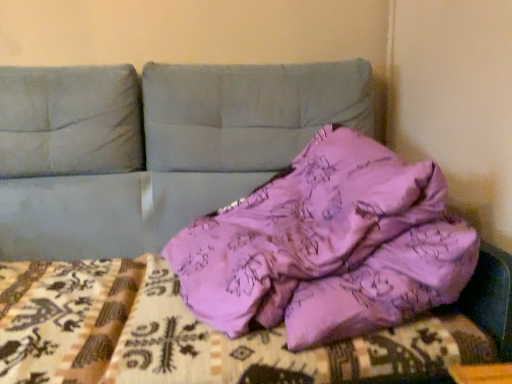
What do you see at coordinates (328, 247) in the screenshot? I see `pink fabric pillow at center` at bounding box center [328, 247].

The width and height of the screenshot is (512, 384). What are the coordinates of `pink fabric pillow at center` in the screenshot? It's located at (328, 247).

This screenshot has width=512, height=384. What do you see at coordinates (218, 333) in the screenshot?
I see `pink fabric at center` at bounding box center [218, 333].

Where is `pink fabric at center`? The height and width of the screenshot is (384, 512). pink fabric at center is located at coordinates (218, 333).

Find the location of `pink fabric pillow at center`. pink fabric pillow at center is located at coordinates (328, 247).

Does pink fabric pillow at center appear on the right side of pink fabric at center?

Indeed, pink fabric pillow at center is positioned on the right side of pink fabric at center.

Is pink fabric pillow at center behind pink fabric at center?

That is False.

Between point (257, 310) and point (220, 347), which one is positioned behind?

The point (257, 310) is more distant.

From the image's perspective, is pink fabric pillow at center under pink fabric at center?

No, from the image's perspective, pink fabric pillow at center is not beneath pink fabric at center.

From a real-world perspective, is pink fabric pillow at center positioned under pink fabric at center based on gravity?

No, from a real-world perspective, pink fabric pillow at center is not under pink fabric at center.

Between pink fabric pillow at center and pink fabric at center, which one has smaller width?

pink fabric at center.

Between pink fabric pillow at center and pink fabric at center, which one has less height?

pink fabric at center.

Considering the sizes of pink fabric pillow at center and pink fabric at center in the image, is pink fabric pillow at center bigger or smaller than pink fabric at center?

In the image, pink fabric pillow at center appears to be larger than pink fabric at center.

Do you think pink fabric pillow at center is within pink fabric at center, or outside of it?

pink fabric pillow at center exists outside the volume of pink fabric at center.

Is pink fabric pillow at center positioned far away from pink fabric at center?

pink fabric pillow at center is actually quite close to pink fabric at center.

Is pink fabric pillow at center turned away from pink fabric at center?

pink fabric pillow at center is not turned away from pink fabric at center.

Measure the distance between pink fabric pillow at center and pink fabric at center.

A distance of 10.14 inches exists between pink fabric pillow at center and pink fabric at center.

Where is `bed frame on the left of pink fabric pillow at center`? bed frame on the left of pink fabric pillow at center is located at coordinates (218, 333).

Visually, is pink fabric at center positioned to the left or to the right of pink fabric pillow at center?

Based on their positions, pink fabric at center is located to the left of pink fabric pillow at center.

Is the depth of pink fabric at center greater than that of pink fabric pillow at center?

Yes, it is.

Which is in front, point (90, 276) or point (389, 217)?

The point (389, 217) is closer to the camera.

From the image's perspective, which is above, pink fabric at center or pink fabric pillow at center?

pink fabric pillow at center, from the image's perspective.

From a real-world perspective, is pink fabric at center physically located above or below pink fabric pillow at center?

pink fabric at center is below pink fabric pillow at center.

Is pink fabric at center wider or thinner than pink fabric pillow at center?

pink fabric at center is thinner than pink fabric pillow at center.

Between pink fabric at center and pink fabric pillow at center, which one has more height?

→ pink fabric pillow at center.

Who is smaller, pink fabric at center or pink fabric pillow at center?

pink fabric at center is smaller.

Do you think pink fabric at center is within pink fabric pillow at center, or outside of it?

pink fabric at center is contained in pink fabric pillow at center.

Is pink fabric at center positioned far away from pink fabric pillow at center?

No.

Is pink fabric at center oriented away from pink fabric pillow at center?

Yes, pink fabric at center is positioned with its back facing pink fabric pillow at center.

How far apart are pink fabric at center and pink fabric pillow at center?

pink fabric at center and pink fabric pillow at center are 10.14 inches apart from each other.

Locate an element on the screen. pillow above the pink fabric at center (from the image's perspective) is located at coordinates (328, 247).

Where is `pillow above the pink fabric at center (from a real-world perspective)`? The width and height of the screenshot is (512, 384). pillow above the pink fabric at center (from a real-world perspective) is located at coordinates (328, 247).

Locate an element on the screen. pillow in front of the pink fabric at center is located at coordinates (328, 247).